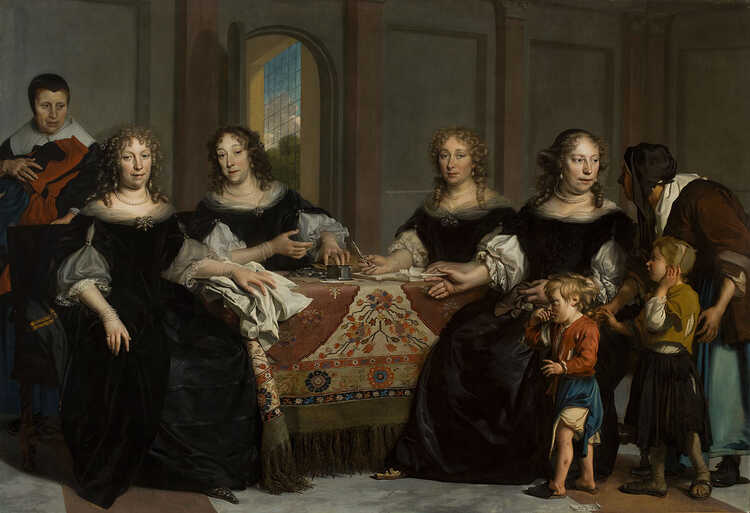
Identify the location of gray stone floor. This screenshot has height=513, width=750. (22, 491), (262, 505), (368, 490), (478, 495), (549, 504), (736, 493).